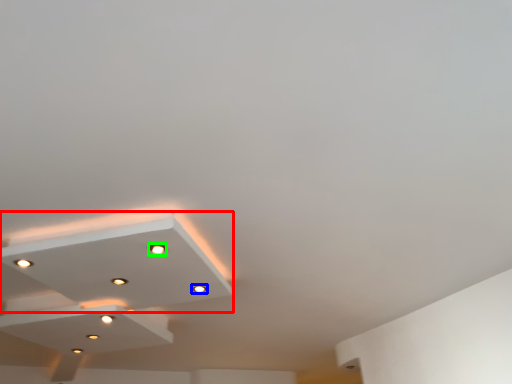
Question: Considering the real-world distances, which object is farthest from lamp (highlighted by a red box)? light (highlighted by a blue box) or droplight (highlighted by a green box)?

Choices:
 (A) light
 (B) droplight

Answer: (A)